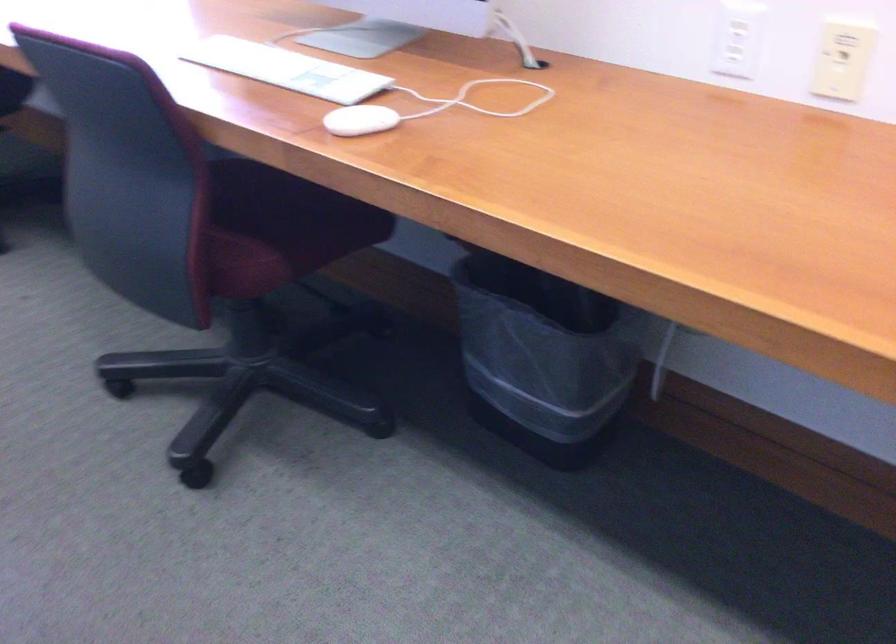
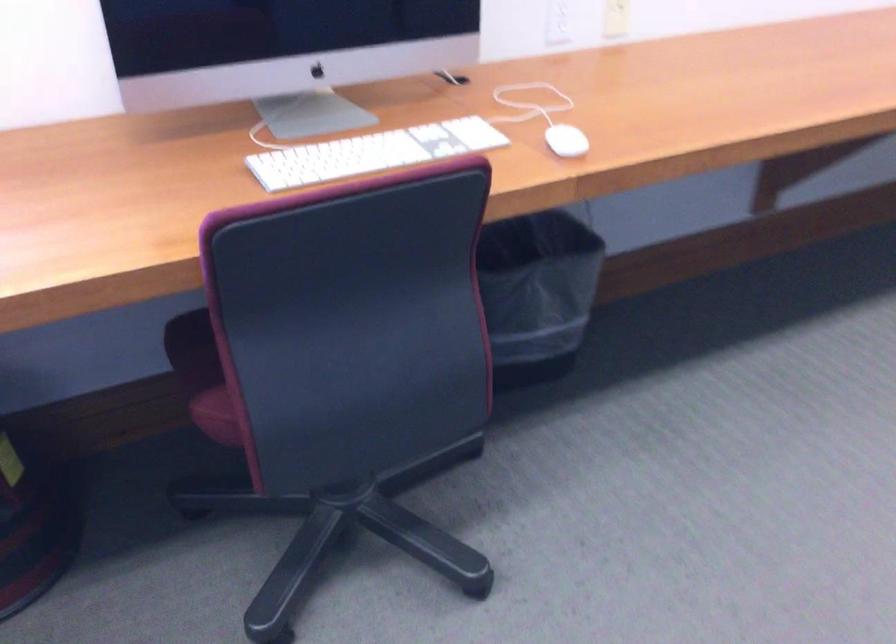
Find the pixel in the second image that matches [490,332] in the first image.

(536, 292)